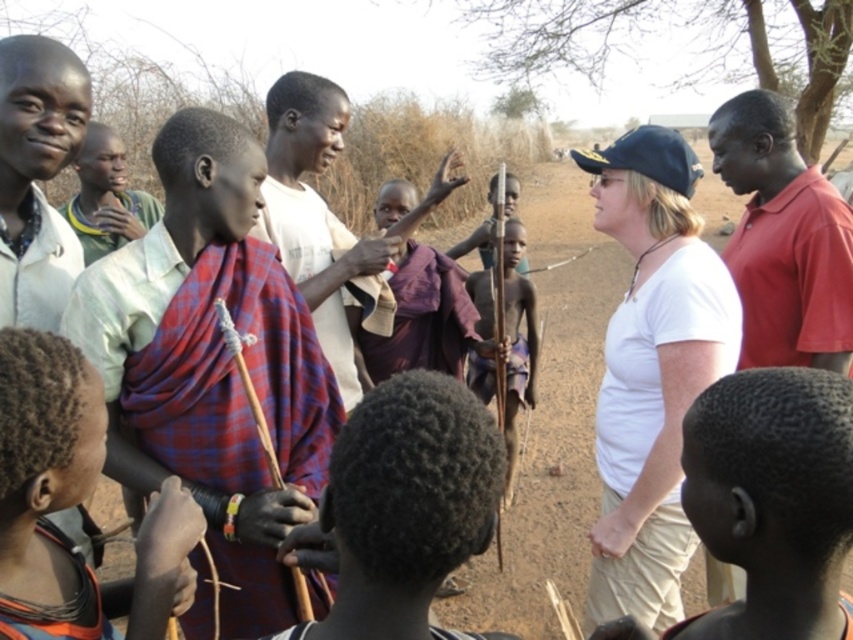
Question: Can you confirm if plaid fabric scarf at center is positioned to the right of matte white shirt at left?

Choices:
 (A) yes
 (B) no

Answer: (A)

Question: Which object appears closest to the camera in this image?

Choices:
 (A) red plaid cloth at center
 (B) red plaid shawl at center

Answer: (A)

Question: Is red smooth shirt at right above red plaid cloth at center?

Choices:
 (A) no
 (B) yes

Answer: (B)

Question: Does plaid fabric scarf at center appear under red smooth shirt at right?

Choices:
 (A) no
 (B) yes

Answer: (B)

Question: Considering the real-world distances, which object is farthest from the matte white shirt at left?

Choices:
 (A) red plaid shawl at center
 (B) red smooth shirt at right
 (C) plaid fabric scarf at center

Answer: (B)

Question: Which point is farther to the camera?

Choices:
 (A) matte white shirt at left
 (B) red smooth shirt at right

Answer: (B)